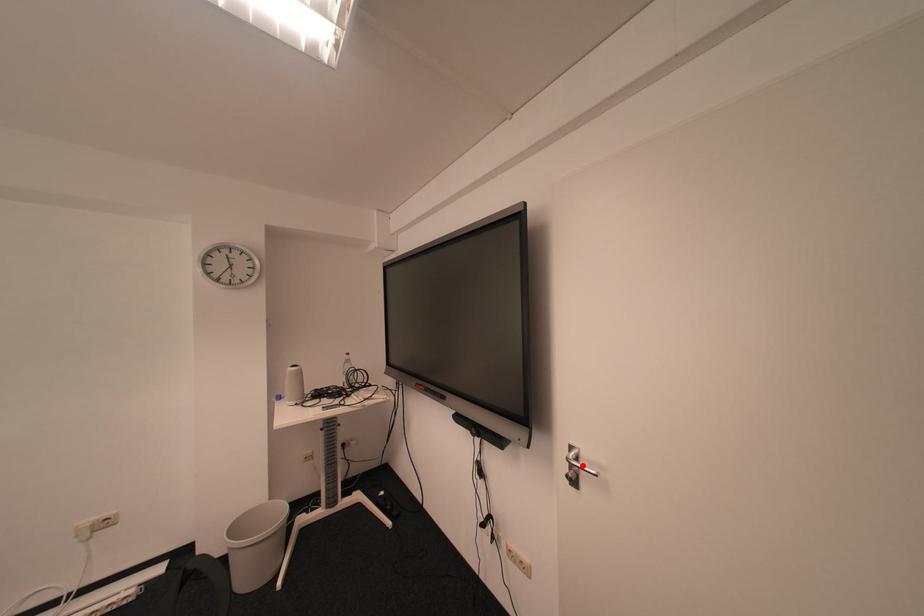
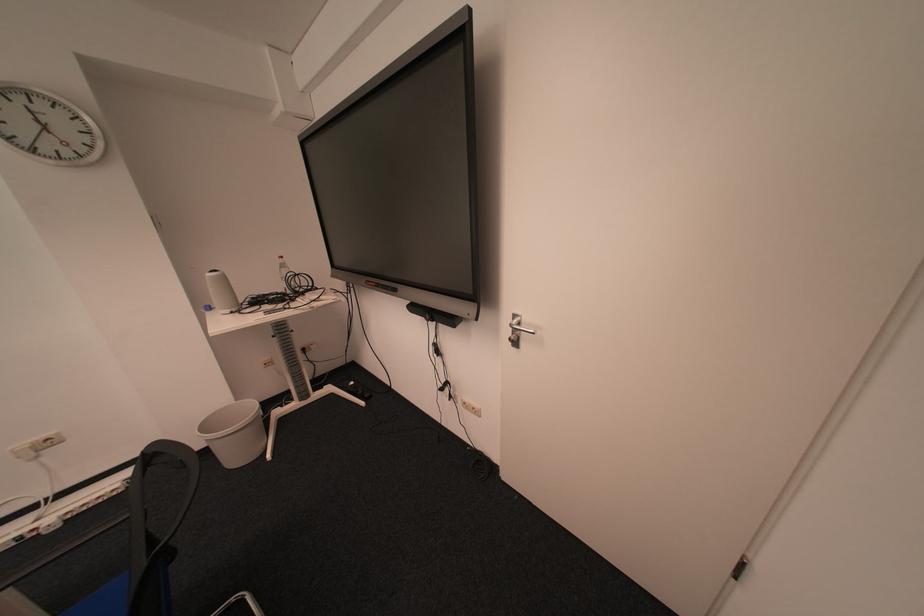
In the second image, find the point that corresponds to the highlighted location in the first image.

(525, 330)